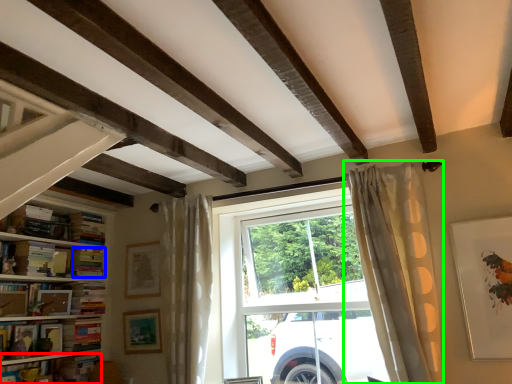
Question: Estimate the real-world distances between objects in this image. Which object is farther from book (highlighted by a red box), book (highlighted by a blue box) or curtain (highlighted by a green box)?

Choices:
 (A) book
 (B) curtain

Answer: (B)